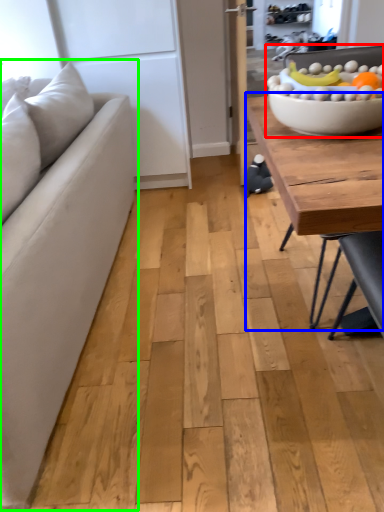
Question: Which object is the closest to the bowl (highlighted by a red box)? Choose among these: coffee table (highlighted by a blue box) or studio couch (highlighted by a green box).

Choices:
 (A) coffee table
 (B) studio couch

Answer: (A)